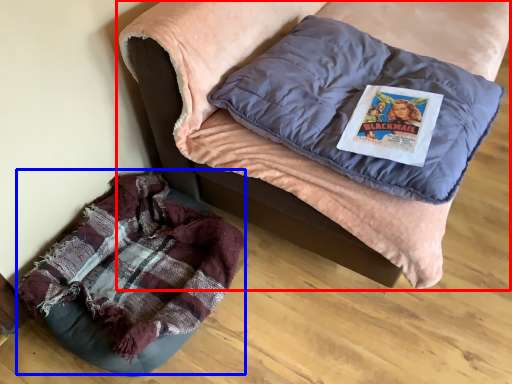
Question: Which point is further to the camera, furniture (highlighted by a red box) or bean bag chair (highlighted by a blue box)?

Choices:
 (A) furniture
 (B) bean bag chair

Answer: (B)